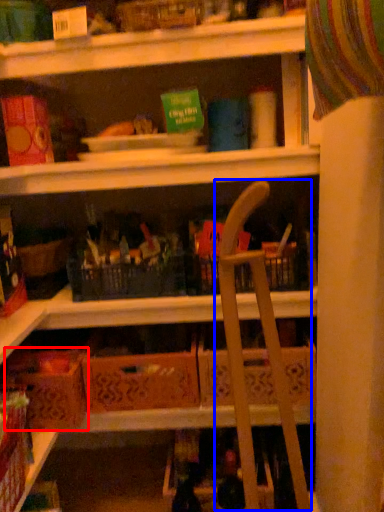
Question: Which object is closer to the camera taking this photo, cardboard box (highlighted by a red box) or folding chair (highlighted by a blue box)?

Choices:
 (A) cardboard box
 (B) folding chair

Answer: (B)